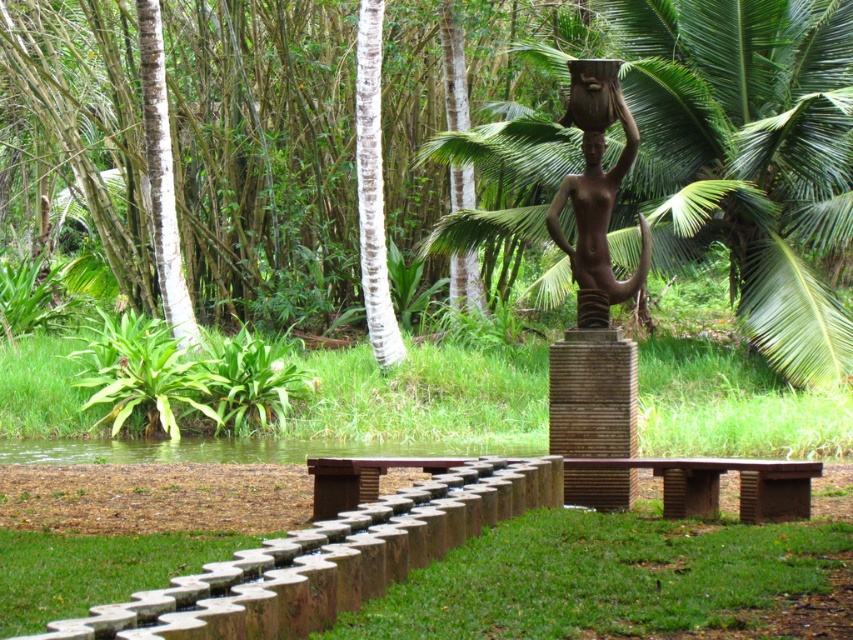
Question: Does green leafy palm tree at center have a larger size compared to bronze statue at upper center?

Choices:
 (A) no
 (B) yes

Answer: (B)

Question: Can you confirm if green leafy palm tree at center is bigger than brown wooden bench at center?

Choices:
 (A) no
 (B) yes

Answer: (A)

Question: Which point is closer to the camera taking this photo?

Choices:
 (A) (612, 458)
 (B) (701, 243)
 (C) (592, 138)

Answer: (A)

Question: Which object is farther from the camera taking this photo?

Choices:
 (A) bronze statue at center
 (B) green leafy palm tree at center
 (C) brown wooden bench at center

Answer: (B)

Question: Is brown wooden bench at center positioned behind bronze statue at upper center?

Choices:
 (A) no
 (B) yes

Answer: (A)

Question: Among these objects, which one is farthest from the camera?

Choices:
 (A) green leafy palm tree at center
 (B) brown wooden bench at center

Answer: (A)